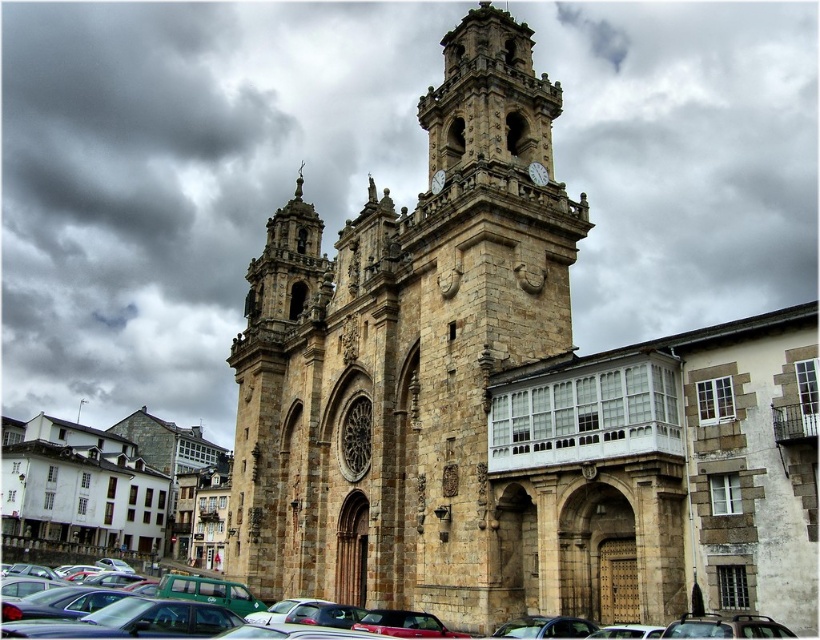
Is stone church at center positioned before metallic silver car at lower center?

No, it is not.

Who is positioned more to the right, stone church at center or metallic silver car at lower center?

stone church at center

Locate an element on the screen. The height and width of the screenshot is (640, 820). stone church at center is located at coordinates (506, 401).